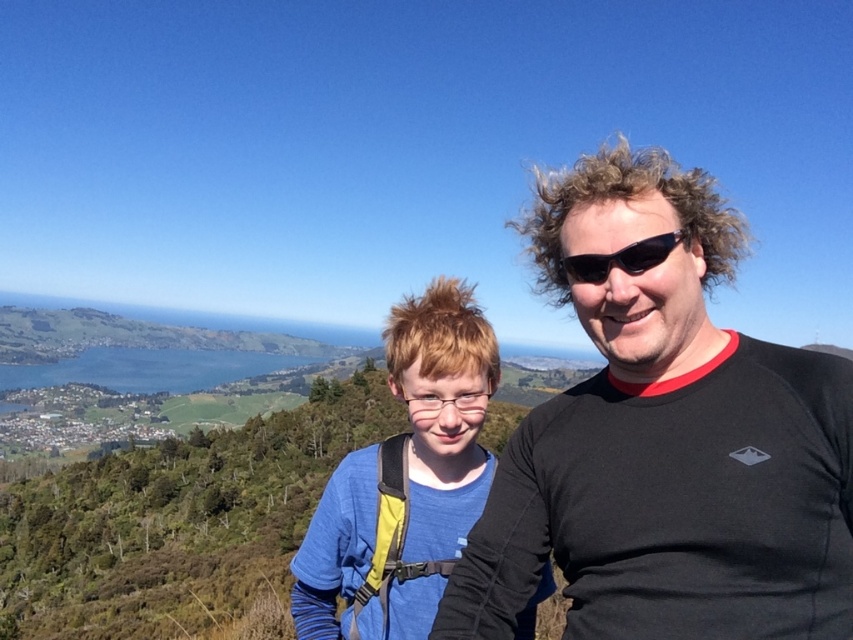
Is point (457, 468) closer to viewer compared to point (664, 240)?

No.

Does blue fabric shirt at center appear on the right side of black plastic sunglasses at center?

No, blue fabric shirt at center is not to the right of black plastic sunglasses at center.

This screenshot has width=853, height=640. In order to click on blue fabric shirt at center in this screenshot , I will do `click(405, 481)`.

Can you confirm if black matte shirt at right is smaller than black plastic sunglasses at center?

No, black matte shirt at right is not smaller than black plastic sunglasses at center.

Does point (556, 410) come closer to viewer compared to point (660, 259)?

No, (556, 410) is further to viewer.

Locate an element on the screen. black matte shirt at right is located at coordinates [665, 442].

Can you confirm if black matte shirt at right is taller than blue fabric shirt at center?

Yes, black matte shirt at right is taller than blue fabric shirt at center.

Does black matte shirt at right appear on the right side of blue fabric shirt at center?

Indeed, black matte shirt at right is positioned on the right side of blue fabric shirt at center.

Between point (738, 220) and point (323, 628), which one is positioned in front?

Point (738, 220) is in front.

At what (x,y) coordinates should I click in order to perform the action: click on black matte shirt at right. Please return your answer as a coordinate pair (x, y). Looking at the image, I should click on (665, 442).